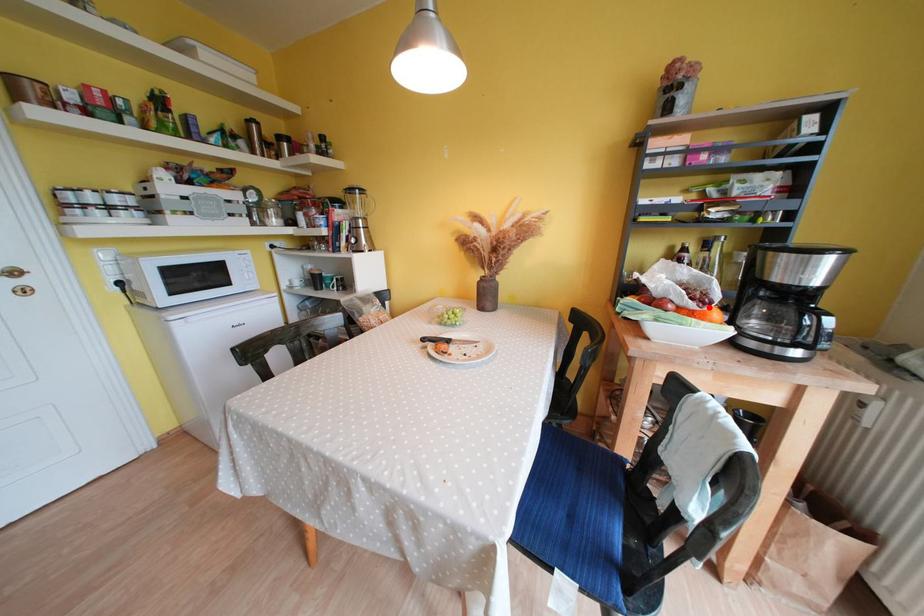
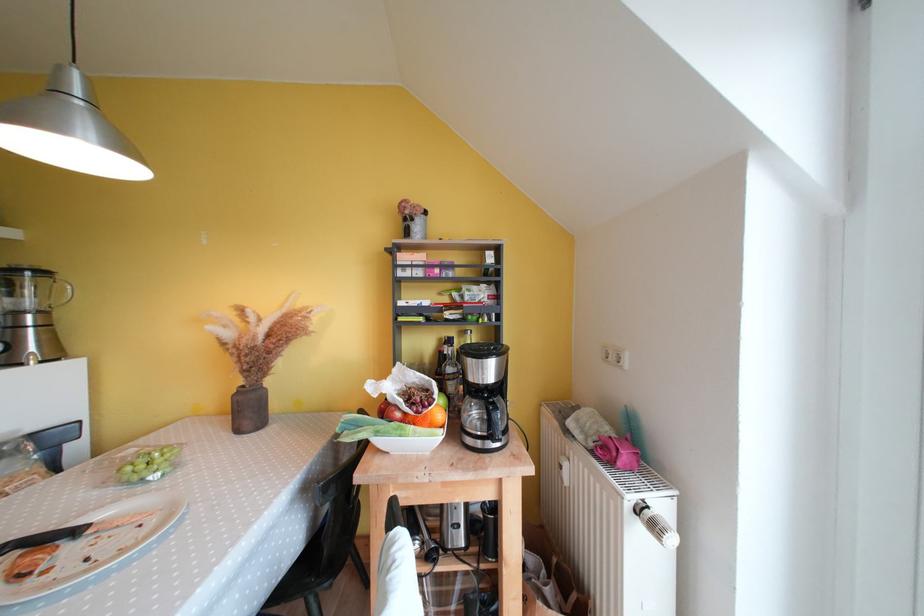
Find the pixel in the second image that matches the highlighted location in the first image.

(431, 411)